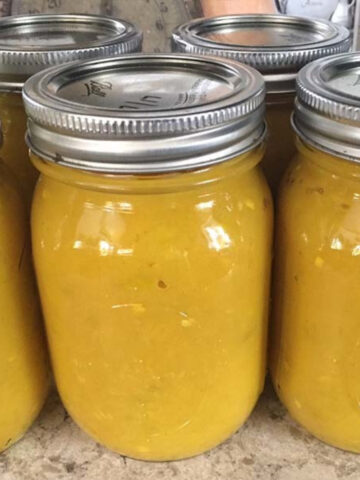
Image resolution: width=360 pixels, height=480 pixels. Identify the location of marble. (260, 450).